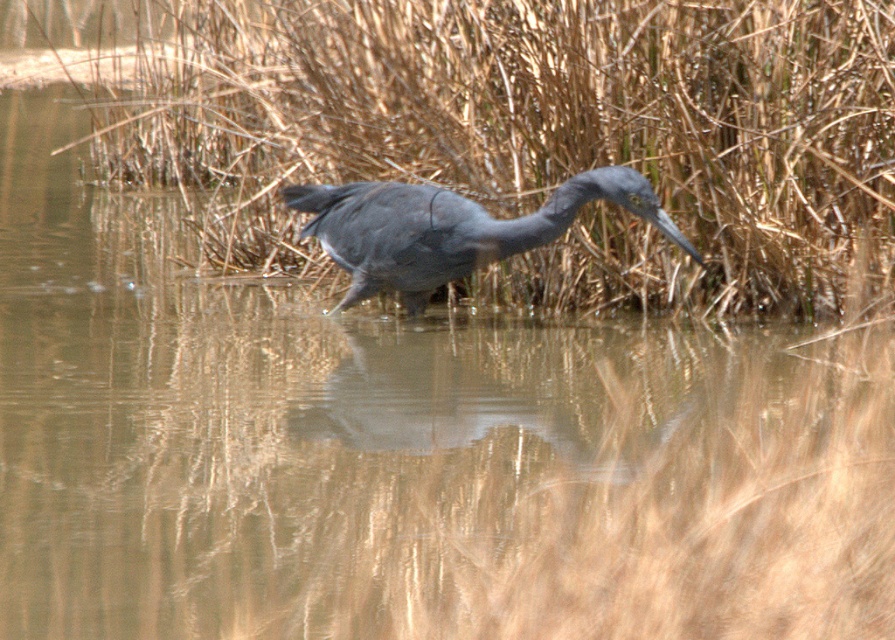
Does point (490, 268) come closer to viewer compared to point (476, 246)?

No.

Is dry reeds at center to the right of matte gray heron at center from the viewer's perspective?

No, dry reeds at center is not to the right of matte gray heron at center.

Does point (493, 8) lie in front of point (406, 234)?

No, it is behind (406, 234).

Locate an element on the screen. Image resolution: width=895 pixels, height=640 pixels. dry reeds at center is located at coordinates (542, 132).